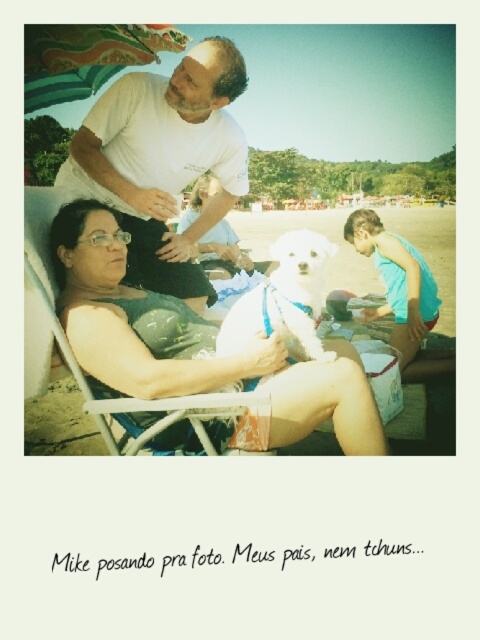
Question: Does white matte t-shirt at upper left lie behind white fluffy dog at center?

Choices:
 (A) no
 (B) yes

Answer: (B)

Question: Among these objects, which one is nearest to the camera?

Choices:
 (A) white matte t-shirt at upper left
 (B) white fluffy dog at center

Answer: (B)

Question: Which of these objects is positioned farthest from the white matte t-shirt at upper left?

Choices:
 (A) white fluffy dog at center
 (B) matte black swimsuit at center

Answer: (B)

Question: Is matte black swimsuit at center positioned at the back of white fluffy dog at center?

Choices:
 (A) yes
 (B) no

Answer: (B)

Question: Can you confirm if matte black swimsuit at center is positioned below white fluffy dog at center?

Choices:
 (A) yes
 (B) no

Answer: (A)

Question: Which point is closer to the camera?

Choices:
 (A) matte black swimsuit at center
 (B) white fluffy dog at center

Answer: (A)